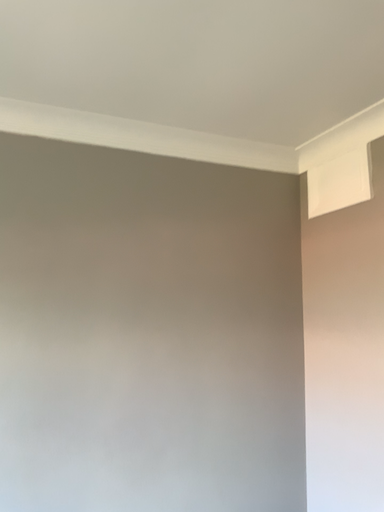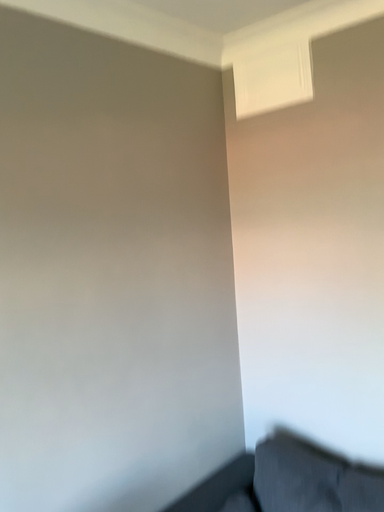
Question: How did the camera likely rotate when shooting the video?

Choices:
 (A) rotated upward
 (B) rotated downward

Answer: (B)